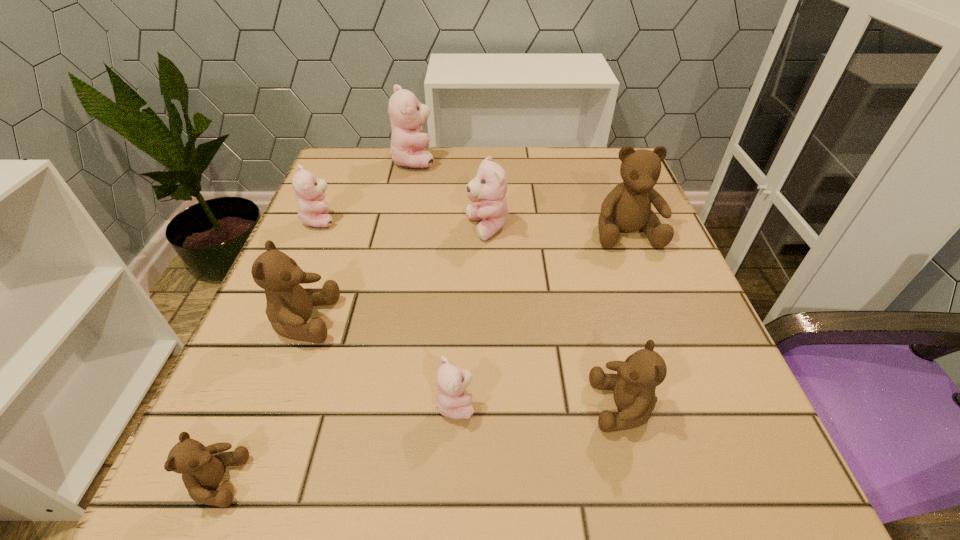
The image size is (960, 540). In the image, there is a desktop. In order to click on free space at the right edge in this screenshot , I will do `click(716, 423)`.

Locate an element on the screen. free space at the far left corner of the desktop is located at coordinates (374, 158).

In the image, there is a desktop. Identify the location of vacant region at the far right corner. Image resolution: width=960 pixels, height=540 pixels. (598, 185).

I want to click on unoccupied position between the second biggest brown teddy bear and the second pink teddy bear from left to right, so click(358, 240).

Identify the location of free space that is in between the second nearest brown teddy bear and the farthest brown teddy bear. (624, 319).

Locate an element on the screen. This screenshot has height=540, width=960. vacant area between the second biggest pink teddy bear and the second nearest brown teddy bear is located at coordinates (555, 318).

At what (x,y) coordinates should I click in order to perform the action: click on free space between the second farthest brown teddy bear and the second biggest pink teddy bear. Please return your answer as a coordinate pair (x, y). The image size is (960, 540). Looking at the image, I should click on (396, 274).

This screenshot has width=960, height=540. Identify the location of vacant space that's between the fifth teddy bear from right to left and the third biggest pink teddy bear. (367, 190).

At what (x,y) coordinates should I click in order to perform the action: click on free spot between the fifth farthest object and the biggest brown teddy bear. Please return your answer as a coordinate pair (x, y). Looking at the image, I should click on (465, 276).

Identify the location of unoccupied position between the second biggest pink teddy bear and the farthest brown teddy bear. pyautogui.click(x=557, y=230).